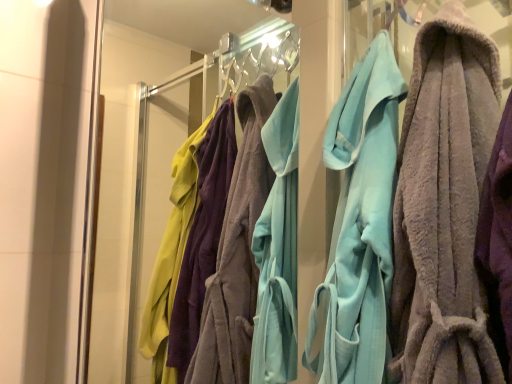
Locate an element on the screen. The image size is (512, 384). transparent glass door at center is located at coordinates (157, 145).

Locate an element on the screen. The width and height of the screenshot is (512, 384). light blue plush robe at center, arranged as the first towel when viewed from the back is located at coordinates (359, 225).

Is light blue plush robe at center, acting as the 2th towel starting from the front, facing towards soft gray towel at center, marked as the second towel in a back-to-front arrangement?

No, light blue plush robe at center, acting as the 2th towel starting from the front, is not aimed at soft gray towel at center, marked as the second towel in a back-to-front arrangement.

Is light blue plush robe at center, acting as the 2th towel starting from the front, not near soft gray towel at center, marked as the second towel in a back-to-front arrangement?

light blue plush robe at center, acting as the 2th towel starting from the front, is actually quite close to soft gray towel at center, marked as the second towel in a back-to-front arrangement.

Which point is more distant from viewer, (x=359, y=353) or (x=418, y=206)?

Point (x=359, y=353)

Is light blue plush robe at center, acting as the 2th towel starting from the front, spatially inside soft gray towel at center, marked as the second towel in a back-to-front arrangement, or outside of it?

The correct answer is: outside.

From a real-world perspective, does light blue plush robe at center, arranged as the first towel when viewed from the back, stand above transparent glass door at center?

No.

Is light blue plush robe at center, arranged as the first towel when viewed from the back, inside the boundaries of transparent glass door at center, or outside?

The correct answer is: outside.

The height and width of the screenshot is (384, 512). I want to click on the 1st towel counting from the right of the transparent glass door at center, so click(359, 225).

Is light blue plush robe at center, arranged as the first towel when viewed from the back, in front of or behind transparent glass door at center in the image?

light blue plush robe at center, arranged as the first towel when viewed from the back, is behind transparent glass door at center.

Is soft gray towel at center, marked as the second towel in a back-to-front arrangement, with light blue plush robe at center, arranged as the first towel when viewed from the back?

No, soft gray towel at center, marked as the second towel in a back-to-front arrangement, is not touching light blue plush robe at center, arranged as the first towel when viewed from the back.

Between soft gray towel at center, marked as the second towel in a back-to-front arrangement, and light blue plush robe at center, arranged as the first towel when viewed from the back, which one has larger width?

With larger width is soft gray towel at center, marked as the second towel in a back-to-front arrangement.

Which of these two, soft gray towel at center, marked as the second towel in a back-to-front arrangement, or light blue plush robe at center, acting as the 2th towel starting from the front, stands taller?

Standing taller between the two is light blue plush robe at center, acting as the 2th towel starting from the front.

What's the angular difference between soft gray towel at center, marked as the 1th towel in a front-to-back arrangement, and light blue plush robe at center, acting as the 2th towel starting from the front,'s facing directions?

They differ by 0.000463 degrees in their facing directions.

Would you say transparent glass door at center is outside light blue plush robe at center, acting as the 2th towel starting from the front?

Yes, transparent glass door at center is outside of light blue plush robe at center, acting as the 2th towel starting from the front.

Who is more distant, transparent glass door at center or light blue plush robe at center, acting as the 2th towel starting from the front?

light blue plush robe at center, acting as the 2th towel starting from the front.

Considering the relative sizes of transparent glass door at center and light blue plush robe at center, arranged as the first towel when viewed from the back, in the image provided, is transparent glass door at center thinner than light blue plush robe at center, arranged as the first towel when viewed from the back,?

Yes.

Which is in front, point (163, 139) or point (409, 123)?

The point (409, 123) is closer to the camera.

Does transparent glass door at center have a larger size compared to soft gray towel at center, marked as the second towel in a back-to-front arrangement?

Correct, transparent glass door at center is larger in size than soft gray towel at center, marked as the second towel in a back-to-front arrangement.

From the image's perspective, which is below, transparent glass door at center or soft gray towel at center, marked as the second towel in a back-to-front arrangement?

transparent glass door at center, from the image's perspective.

Where is `glass door below the soft gray towel at center, marked as the 1th towel in a front-to-back arrangement (from a real-world perspective)`? The image size is (512, 384). glass door below the soft gray towel at center, marked as the 1th towel in a front-to-back arrangement (from a real-world perspective) is located at coordinates (157, 145).

From the image's perspective, is soft gray towel at center, marked as the 1th towel in a front-to-back arrangement, above or below transparent glass door at center?

soft gray towel at center, marked as the 1th towel in a front-to-back arrangement, is situated higher than transparent glass door at center in the image.

From a real-world perspective, is soft gray towel at center, marked as the 1th towel in a front-to-back arrangement, below transparent glass door at center?

No, from a real-world perspective, soft gray towel at center, marked as the 1th towel in a front-to-back arrangement, is not below transparent glass door at center.

Between soft gray towel at center, marked as the second towel in a back-to-front arrangement, and transparent glass door at center, which one has more height?

Standing taller between the two is transparent glass door at center.

The height and width of the screenshot is (384, 512). What are the coordinates of `towel above the light blue plush robe at center, acting as the 2th towel starting from the front (from the image's perspective)` in the screenshot? It's located at (444, 206).

The width and height of the screenshot is (512, 384). What are the coordinates of `glass door located above the light blue plush robe at center, arranged as the first towel when viewed from the back (from a real-world perspective)` in the screenshot? It's located at (157, 145).

From the image, which object appears to be nearer to light blue plush robe at center, acting as the 2th towel starting from the front, soft gray towel at center, marked as the second towel in a back-to-front arrangement, or transparent glass door at center?

The object closer to light blue plush robe at center, acting as the 2th towel starting from the front, is soft gray towel at center, marked as the second towel in a back-to-front arrangement.

When comparing their distances from transparent glass door at center, does soft gray towel at center, marked as the 1th towel in a front-to-back arrangement, or light blue plush robe at center, acting as the 2th towel starting from the front, seem closer?

light blue plush robe at center, acting as the 2th towel starting from the front, is positioned closer to the anchor transparent glass door at center.

Considering their positions, is light blue plush robe at center, arranged as the first towel when viewed from the back, positioned closer to soft gray towel at center, marked as the 1th towel in a front-to-back arrangement, than transparent glass door at center?

light blue plush robe at center, arranged as the first towel when viewed from the back, is positioned closer to the anchor soft gray towel at center, marked as the 1th towel in a front-to-back arrangement.

When comparing their distances from light blue plush robe at center, arranged as the first towel when viewed from the back, does transparent glass door at center or soft gray towel at center, marked as the 1th towel in a front-to-back arrangement, seem further?

transparent glass door at center.

From the image, which object appears to be nearer to soft gray towel at center, marked as the second towel in a back-to-front arrangement, transparent glass door at center or light blue plush robe at center, arranged as the first towel when viewed from the back?

light blue plush robe at center, arranged as the first towel when viewed from the back.

Estimate the real-world distances between objects in this image. Which object is further from transparent glass door at center, light blue plush robe at center, arranged as the first towel when viewed from the back, or soft gray towel at center, marked as the second towel in a back-to-front arrangement?

Among the two, soft gray towel at center, marked as the second towel in a back-to-front arrangement, is located further to transparent glass door at center.

Find the location of a particular element. This screenshot has width=512, height=384. towel situated between transparent glass door at center and soft gray towel at center, marked as the 1th towel in a front-to-back arrangement, from left to right is located at coordinates (359, 225).